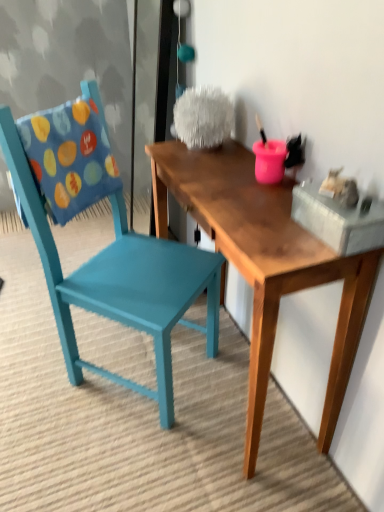
This screenshot has width=384, height=512. In order to click on free point below wooden table at center (from a real-world perspective) in this screenshot , I will do [x=238, y=393].